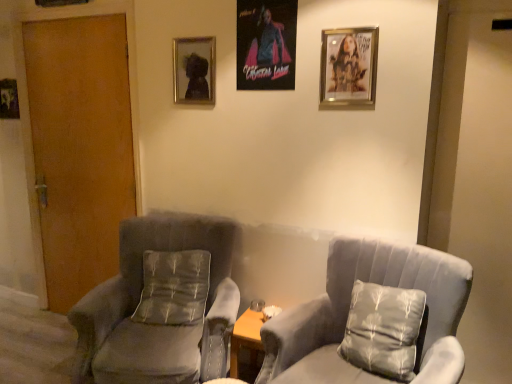
Identify the location of free point above wooden door at left (from a real-world perspective). The width and height of the screenshot is (512, 384). (70, 15).